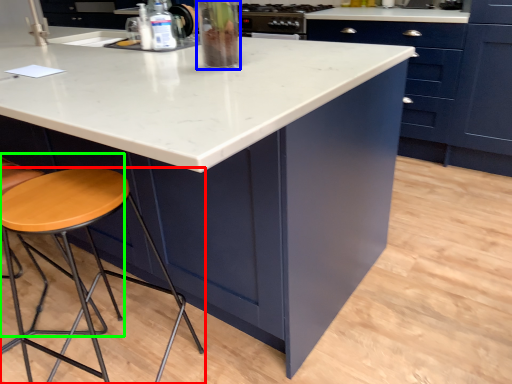
Question: Estimate the real-world distances between objects in this image. Which object is farther from stool (highlighted by a red box), appliance (highlighted by a blue box) or chair (highlighted by a green box)?

Choices:
 (A) appliance
 (B) chair

Answer: (A)